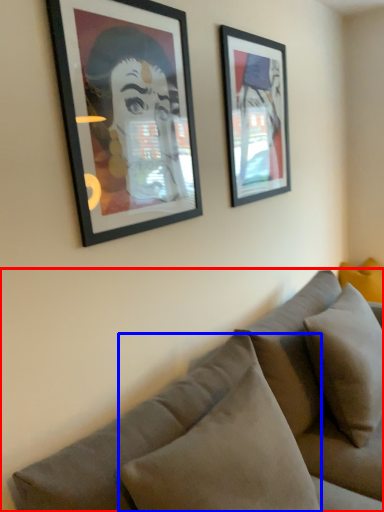
Question: Among these objects, which one is farthest to the camera, studio couch (highlighted by a red box) or pillow (highlighted by a blue box)?

Choices:
 (A) studio couch
 (B) pillow

Answer: (B)